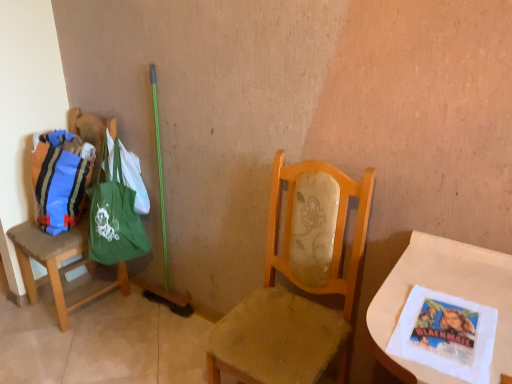
Question: Does green canvas tote at left have a larger size compared to green fabric bag at left, the 2th chair when ordered from front to back?

Choices:
 (A) yes
 (B) no

Answer: (B)

Question: From the image's perspective, would you say green canvas tote at left is positioned over green fabric bag at left, which is the 1th chair in left-to-right order?

Choices:
 (A) no
 (B) yes

Answer: (B)

Question: Can you confirm if green canvas tote at left is smaller than green fabric bag at left, the second chair when ordered from right to left?

Choices:
 (A) no
 (B) yes

Answer: (B)

Question: Can you confirm if green canvas tote at left is shorter than green fabric bag at left, which is the 1th chair in left-to-right order?

Choices:
 (A) no
 (B) yes

Answer: (B)

Question: Is green canvas tote at left positioned beyond the bounds of green fabric bag at left, marked as the 1th chair in a back-to-front arrangement?

Choices:
 (A) no
 (B) yes

Answer: (B)

Question: From the image's perspective, is wooden chair at center, which is counted as the 1th chair, starting from the front, positioned above or below white paper napkin at lower right?

Choices:
 (A) below
 (B) above

Answer: (A)

Question: From a real-world perspective, is wooden chair at center, arranged as the first chair when viewed from the right, physically located above or below white paper napkin at lower right?

Choices:
 (A) above
 (B) below

Answer: (B)

Question: Is point (340, 375) closer or farther from the camera than point (497, 306)?

Choices:
 (A) closer
 (B) farther

Answer: (B)

Question: Based on their sizes in the image, would you say wooden chair at center, arranged as the first chair when viewed from the right, is bigger or smaller than white paper napkin at lower right?

Choices:
 (A) big
 (B) small

Answer: (A)

Question: Considering the positions of point (386, 319) and point (36, 185), is point (386, 319) closer or farther from the camera than point (36, 185)?

Choices:
 (A) farther
 (B) closer

Answer: (B)

Question: Is white paper napkin at lower right spatially inside matte blue fabric bag at left, or outside of it?

Choices:
 (A) inside
 (B) outside

Answer: (B)

Question: Considering their positions, is white paper napkin at lower right located in front of or behind matte blue fabric bag at left?

Choices:
 (A) behind
 (B) front

Answer: (B)

Question: From the image's perspective, is white paper napkin at lower right above or below matte blue fabric bag at left?

Choices:
 (A) below
 (B) above

Answer: (A)

Question: Is matte blue fabric bag at left taller or shorter than white paper napkin at lower right?

Choices:
 (A) short
 (B) tall

Answer: (B)

Question: Is point (51, 140) positioned closer to the camera than point (397, 259)?

Choices:
 (A) farther
 (B) closer

Answer: (A)